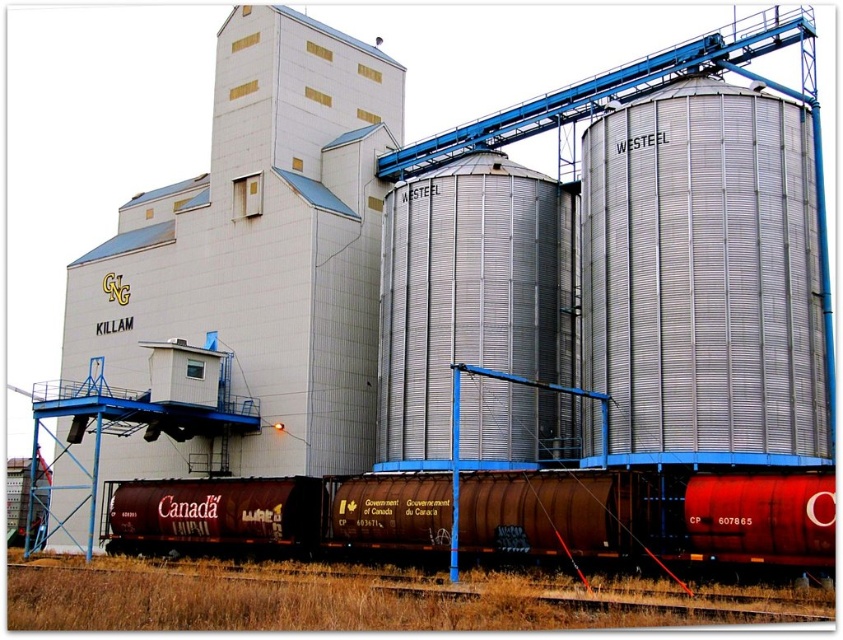
Consider the image. You are a drone operator tasked with capturing aerial footage of the silver metallic silo at center. The drone must maintain a safe distance of at least 100 meters from the silo to avoid interference with its operations. Given the silo is located at coordinates point 0.461, 0.555, can you determine if the drone is currently positioned safely?

The silver metallic silo at center is located at coordinates point (466, 294). However, without knowing the drone operator position coordinates, it is impossible to determine the distance between the drone and the silo. The question does not provide enough information to confirm if the drone is maintaining a safe distance of at least 100 meters.

You are a railway inspector checking the railway tracks. You notice a rusty metal train car at lower center and a brown rusted metal train track at lower center. Which one has a smaller width?

The rusty metal train car at lower center has a smaller width than the brown rusted metal train track at lower center.